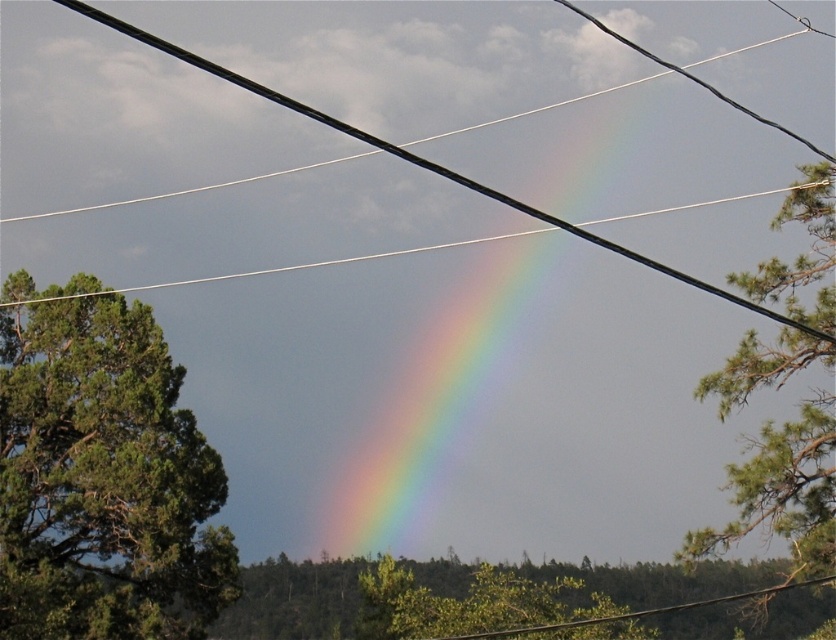
Is point (207, 508) positioned behind point (765, 308)?

Yes, it is behind point (765, 308).

Is the position of green leafy tree at left more distant than that of black wire at center?

Yes, green leafy tree at left is behind black wire at center.

Who is more distant from viewer, (x=44, y=344) or (x=405, y=156)?

The point (x=44, y=344) is more distant.

At what (x,y) coordinates should I click in order to perform the action: click on green leafy tree at left. Please return your answer as a coordinate pair (x, y). Looking at the image, I should click on (103, 481).

Which is behind, point (18, 404) or point (641, 588)?

The point (641, 588) is behind.

Does green leafy tree at left lie behind green leafy tree at lower center?

That is False.

You are a GUI agent. You are given a task and a screenshot of the screen. Output one action in this format:
    pyautogui.click(x=<x>, y=<y>)
    Task: Click on the green leafy tree at left
    The image size is (836, 640).
    Given the screenshot: What is the action you would take?
    pyautogui.click(x=103, y=481)

Is point (520, 378) in front of point (819, 472)?

That is False.

Between rainbow at center and green leafy tree at right, which one has more height?

With more height is rainbow at center.

Which is behind, point (289, 67) or point (758, 296)?

The point (289, 67) is more distant.

Identify the location of rainbow at center. This screenshot has height=640, width=836. (475, 380).